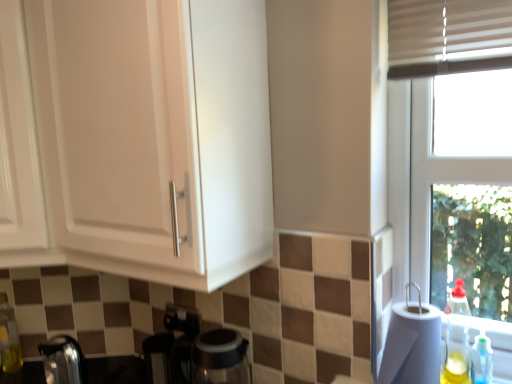
Where is `translucent glass bottle at lower left, which ranks as the third bottle in front-to-back order`? translucent glass bottle at lower left, which ranks as the third bottle in front-to-back order is located at coordinates (9, 338).

Image resolution: width=512 pixels, height=384 pixels. What do you see at coordinates (158, 357) in the screenshot? I see `metallic stainless steel kettle at lower left` at bounding box center [158, 357].

You are a GUI agent. You are given a task and a screenshot of the screen. Output one action in this format:
    pyautogui.click(x=<x>, y=<y>)
    Task: Click on the white matte cabinet at upper left, marked as the 2th cabinetry in a left-to-right arrangement
    
    Given the screenshot: What is the action you would take?
    pyautogui.click(x=144, y=137)

Where is `translucent plastic soap dispenser at lower right, which appears as the 1th bottle when viewed from the front`? The width and height of the screenshot is (512, 384). translucent plastic soap dispenser at lower right, which appears as the 1th bottle when viewed from the front is located at coordinates (482, 360).

The image size is (512, 384). Find the location of `translucent glass bottle at lower left, which ranks as the third bottle in right-to-left order`. translucent glass bottle at lower left, which ranks as the third bottle in right-to-left order is located at coordinates (9, 338).

Is white paper towel at right to the right of satin chrome faucet at lower left from the viewer's perspective?

Yes.

How different are the orientations of white paper towel at right and satin chrome faucet at lower left in degrees?

The facing directions of white paper towel at right and satin chrome faucet at lower left are 6.45 degrees apart.

Is white paper towel at right next to satin chrome faucet at lower left?

No, white paper towel at right is not in contact with satin chrome faucet at lower left.

Is white paper towel at right inside the boundaries of satin chrome faucet at lower left, or outside?

white paper towel at right is spatially situated outside satin chrome faucet at lower left.

Which is more to the left, metallic stainless steel kettle at lower left or translucent plastic soap dispenser at lower right, which appears as the 1th bottle when viewed from the front?

metallic stainless steel kettle at lower left.

From the picture: From a real-world perspective, which is physically below, metallic stainless steel kettle at lower left or translucent plastic soap dispenser at lower right, arranged as the 1th bottle when viewed from the right?

metallic stainless steel kettle at lower left.

Is point (158, 353) more distant than point (473, 353)?

Yes, point (158, 353) is farther from viewer.

Considering the relative sizes of metallic stainless steel kettle at lower left and translucent plastic soap dispenser at lower right, the 3th bottle positioned from the left, in the image provided, is metallic stainless steel kettle at lower left thinner than translucent plastic soap dispenser at lower right, the 3th bottle positioned from the left,?

In fact, metallic stainless steel kettle at lower left might be wider than translucent plastic soap dispenser at lower right, the 3th bottle positioned from the left.

Would you say metallic stainless steel kettle at lower left is a long distance from white matte cabinet at upper left, marked as the 2th cabinetry in a left-to-right arrangement?

No, metallic stainless steel kettle at lower left is not far from white matte cabinet at upper left, marked as the 2th cabinetry in a left-to-right arrangement.

From a real-world perspective, is metallic stainless steel kettle at lower left positioned under white matte cabinet at upper left, marked as the 2th cabinetry in a left-to-right arrangement, based on gravity?

Indeed, from a real-world perspective, metallic stainless steel kettle at lower left is positioned beneath white matte cabinet at upper left, marked as the 2th cabinetry in a left-to-right arrangement.

Is white matte cabinet at upper left, marked as the 2th cabinetry in a left-to-right arrangement, aimed at white paper towel at right?

No.

In order to click on paper towel behind the white matte cabinet at upper left, the first cabinetry in the right-to-left sequence in this screenshot , I will do `click(412, 345)`.

Can you confirm if white matte cabinet at upper left, marked as the 2th cabinetry in a left-to-right arrangement, is smaller than white paper towel at right?

Incorrect, white matte cabinet at upper left, marked as the 2th cabinetry in a left-to-right arrangement, is not smaller in size than white paper towel at right.

Would you say metallic stainless steel kettle at lower left is part of satin chrome faucet at lower left's contents?

No, metallic stainless steel kettle at lower left is located outside of satin chrome faucet at lower left.

From the image's perspective, between satin chrome faucet at lower left and metallic stainless steel kettle at lower left, who is located below?

metallic stainless steel kettle at lower left appears lower in the image.

Is satin chrome faucet at lower left oriented away from metallic stainless steel kettle at lower left?

No, satin chrome faucet at lower left is not facing away from metallic stainless steel kettle at lower left.

Considering the points (72, 379) and (152, 341), which point is behind, point (72, 379) or point (152, 341)?

Positioned behind is point (152, 341).

From the picture: Is satin chrome faucet at lower left oriented away from translucent plastic bottle at right, arranged as the 2th bottle when viewed from the left?

satin chrome faucet at lower left is not turned away from translucent plastic bottle at right, arranged as the 2th bottle when viewed from the left.

Which is behind, point (53, 337) or point (457, 361)?

The point (53, 337) is more distant.

Looking at this image, who is shorter, satin chrome faucet at lower left or translucent plastic bottle at right, arranged as the 2th bottle when viewed from the left?

satin chrome faucet at lower left is shorter.

From a real-world perspective, is satin chrome faucet at lower left under translucent plastic bottle at right, which is the second bottle from right to left?

Yes, from a real-world perspective, satin chrome faucet at lower left is under translucent plastic bottle at right, which is the second bottle from right to left.

Is white matte cabinet at upper left, the first cabinetry in the right-to-left sequence, with translucent plastic bottle at right, the second bottle viewed from the back?

No.

In the scene shown: From a real-world perspective, is white matte cabinet at upper left, the first cabinetry in the right-to-left sequence, physically located above or below translucent plastic bottle at right, arranged as the 2th bottle when viewed from the left?

From a real-world perspective, white matte cabinet at upper left, the first cabinetry in the right-to-left sequence, is physically above translucent plastic bottle at right, arranged as the 2th bottle when viewed from the left.

Is white matte cabinet at upper left, marked as the 2th cabinetry in a left-to-right arrangement, aimed at translucent plastic bottle at right, which is the second bottle from front to back?

No, white matte cabinet at upper left, marked as the 2th cabinetry in a left-to-right arrangement, is not turned towards translucent plastic bottle at right, which is the second bottle from front to back.

Locate an element on the screen. This screenshot has height=384, width=512. faucet located on the left of white paper towel at right is located at coordinates (63, 361).

Locate an element on the screen. The image size is (512, 384). appliance that is below the translucent plastic soap dispenser at lower right, the 3th bottle positioned from the left (from the image's perspective) is located at coordinates (158, 357).

Considering their positions, is transparent glass coffee machine at lower center positioned closer to metallic stainless steel kettle at lower left than translucent glass bottle at lower left, the 1th bottle from the back?

Based on the image, transparent glass coffee machine at lower center appears to be nearer to metallic stainless steel kettle at lower left.

Looking at the image, which one is located closer to white matte cabinet at upper left, the first cabinetry in the right-to-left sequence, translucent plastic soap dispenser at lower right, which appears as the 1th bottle when viewed from the front, or white paper towel at right?

white paper towel at right is positioned closer to the anchor white matte cabinet at upper left, the first cabinetry in the right-to-left sequence.

When comparing their distances from satin chrome faucet at lower left, does white glossy cabinet at upper left, the 2th cabinetry positioned from the right, or translucent plastic soap dispenser at lower right, which appears as the 1th bottle when viewed from the front, seem closer?

Among the two, white glossy cabinet at upper left, the 2th cabinetry positioned from the right, is located nearer to satin chrome faucet at lower left.

Looking at this image, looking at the image, which one is located further to translucent plastic bottle at right, the second bottle viewed from the back, transparent glass coffee machine at lower center or translucent glass bottle at lower left, the 1th bottle in the left-to-right sequence?

translucent glass bottle at lower left, the 1th bottle in the left-to-right sequence, is positioned further to the anchor translucent plastic bottle at right, the second bottle viewed from the back.

Estimate the real-world distances between objects in this image. Which object is closer to metallic stainless steel kettle at lower left, satin chrome faucet at lower left or transparent glass coffee machine at lower center?

The object closer to metallic stainless steel kettle at lower left is transparent glass coffee machine at lower center.

Estimate the real-world distances between objects in this image. Which object is further from white glossy cabinet at upper left, the 2th cabinetry positioned from the right, translucent glass bottle at lower left, which ranks as the third bottle in front-to-back order, or transparent glass coffee machine at lower center?

transparent glass coffee machine at lower center lies further to white glossy cabinet at upper left, the 2th cabinetry positioned from the right, than the other object.

Considering their positions, is white glossy cabinet at upper left, positioned as the first cabinetry in left-to-right order, positioned further to white matte cabinet at upper left, marked as the 2th cabinetry in a left-to-right arrangement, than translucent plastic soap dispenser at lower right, arranged as the 1th bottle when viewed from the right?

translucent plastic soap dispenser at lower right, arranged as the 1th bottle when viewed from the right, is further to white matte cabinet at upper left, marked as the 2th cabinetry in a left-to-right arrangement.

When comparing their distances from white glossy cabinet at upper left, the 2th cabinetry positioned from the right, does translucent glass bottle at lower left, which ranks as the third bottle in front-to-back order, or translucent plastic bottle at right, the second bottle viewed from the back, seem closer?

The object closer to white glossy cabinet at upper left, the 2th cabinetry positioned from the right, is translucent glass bottle at lower left, which ranks as the third bottle in front-to-back order.

In order to click on cabinetry between white glossy cabinet at upper left, positioned as the first cabinetry in left-to-right order, and metallic stainless steel kettle at lower left in the up-down direction in this screenshot , I will do `click(144, 137)`.

Identify the location of cabinetry between satin chrome faucet at lower left and translucent plastic soap dispenser at lower right, arranged as the third bottle when viewed from the back, in the horizontal direction. (144, 137).

At what (x,y) coordinates should I click in order to perform the action: click on cabinetry between satin chrome faucet at lower left and translucent plastic bottle at right, which is the second bottle from right to left, in the horizontal direction. Please return your answer as a coordinate pair (x, y). The width and height of the screenshot is (512, 384). Looking at the image, I should click on (144, 137).

Locate an element on the screen. Image resolution: width=512 pixels, height=384 pixels. coffee machine between metallic stainless steel kettle at lower left and translucent plastic soap dispenser at lower right, the 3th bottle positioned from the left, in the horizontal direction is located at coordinates (221, 358).